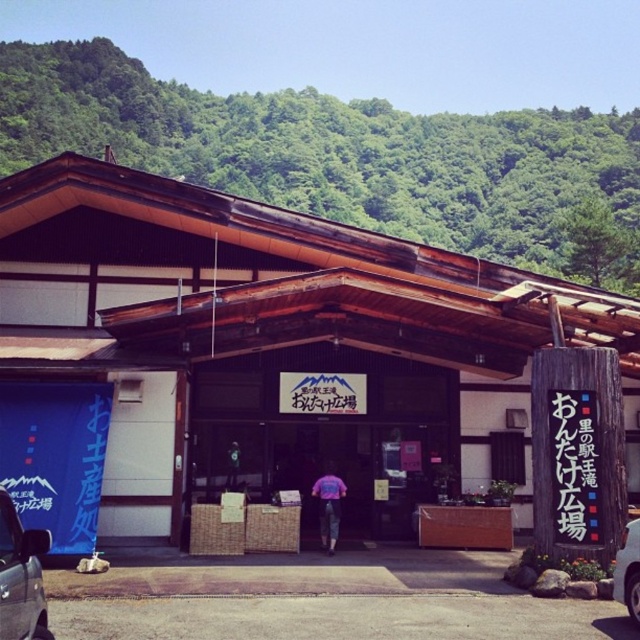
You are a tourist standing in front of the traditional Japanese building and see two cars, a metallic gray car at lower left and a white glossy car at lower right. Which car is closer to the entrance of the building?

The metallic gray car at lower left is positioned on the left side of the white glossy car at lower right, so it is closer to the entrance of the traditional Japanese building.

You are a tourist standing in front of the traditional Japanese building. You want to take a photo that includes both the white wood store at center and the metallic gray car at lower left. Which object should be placed closer to the center of the photo to ensure both are fully visible?

The white wood store at center should be placed closer to the center of the photo because its width is greater than the metallic gray car at lower left, making it more prominent and ensuring both fit within the frame.

You are standing in front of the traditional Japanese building and want to take a photo that includes both the green leafy hillside at upper center and the large signboard with Japanese characters above the entrance. Based on their positions, which object is higher in the image?

The green leafy hillside at upper center is located at point (339, 154), which is higher than the large signboard with Japanese characters above the entrance. Therefore, the green leafy hillside at upper center is higher in the image.